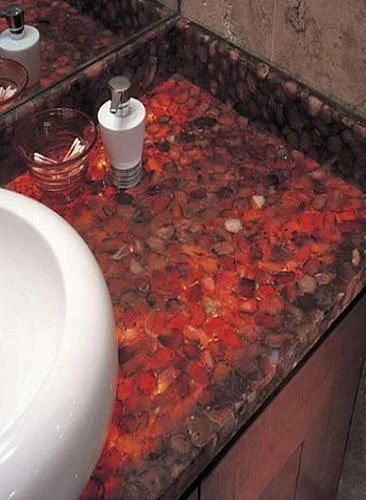
Identify the location of floor. (360, 488).